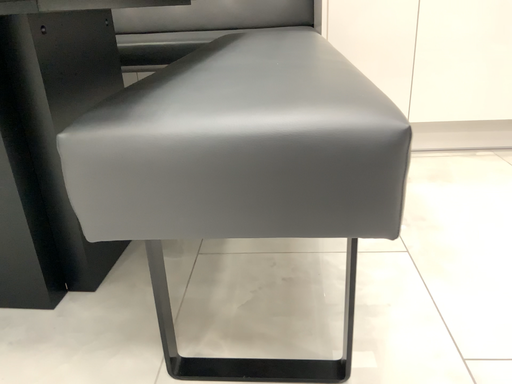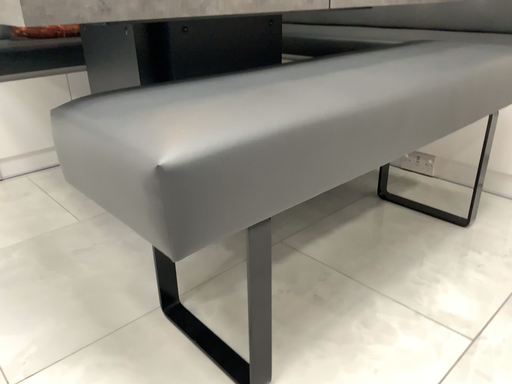
Question: Which way did the camera rotate in the video?

Choices:
 (A) rotated right
 (B) rotated left

Answer: (B)